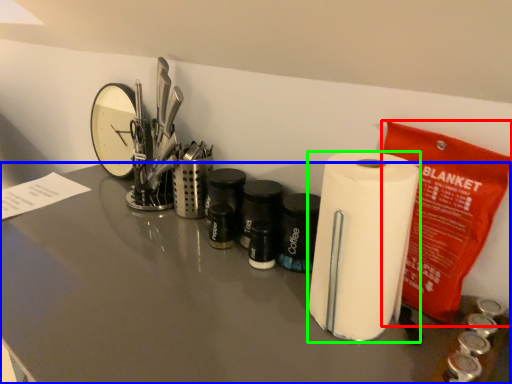
Question: Considering the real-world distances, which object is farthest from stationery (highlighted by a red box)? counter top (highlighted by a blue box) or paper towel (highlighted by a green box)?

Choices:
 (A) counter top
 (B) paper towel

Answer: (A)